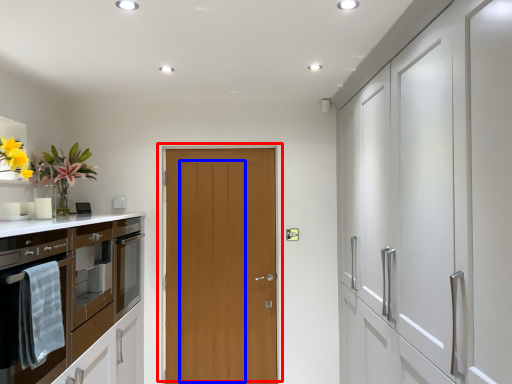
Question: Which of the following is the closest to the observer, door (highlighted by a red box) or door (highlighted by a blue box)?

Choices:
 (A) door
 (B) door

Answer: (A)